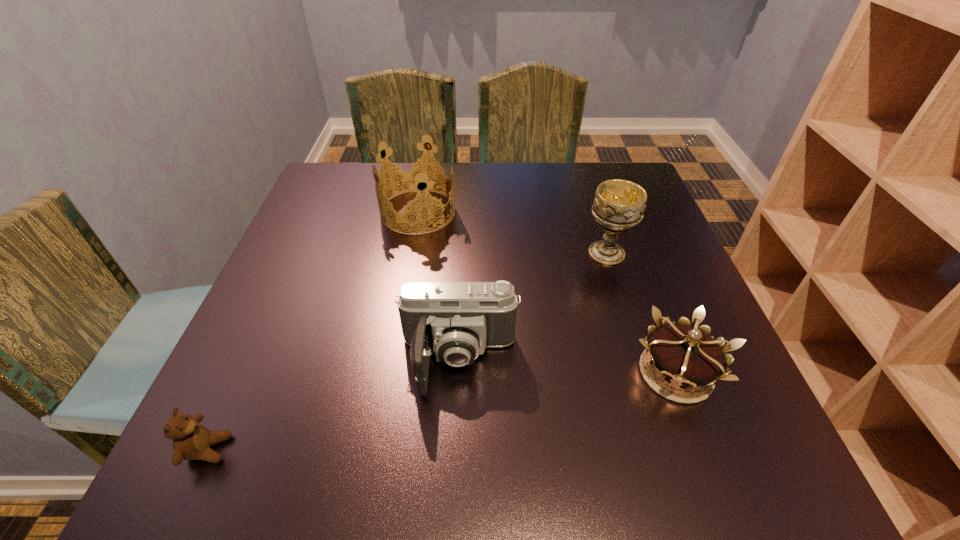
I want to click on blank area at the near edge, so click(x=480, y=480).

Locate an element on the screen. The image size is (960, 540). vacant space at the left edge is located at coordinates (304, 287).

In order to click on blank area at the right edge in this screenshot , I will do `click(628, 286)`.

This screenshot has width=960, height=540. In the image, there is a desktop. In order to click on free space at the far left corner in this screenshot , I will do `click(349, 165)`.

Image resolution: width=960 pixels, height=540 pixels. Identify the location of vacant region at the far right corner. (578, 163).

The image size is (960, 540). In the image, there is a desktop. Find the location of `vacant region at the near right corner`. vacant region at the near right corner is located at coordinates (732, 458).

Find the location of a particular element. This screenshot has width=960, height=540. vacant area that lies between the chalice and the taller crown is located at coordinates (513, 232).

Identify the location of vacant area that lies between the shortest object and the second farthest object. pos(407,351).

I want to click on free spot between the chalice and the third shortest object, so click(533, 307).

Where is `vacant area that lies between the camera and the chalice`? Image resolution: width=960 pixels, height=540 pixels. vacant area that lies between the camera and the chalice is located at coordinates (533, 307).